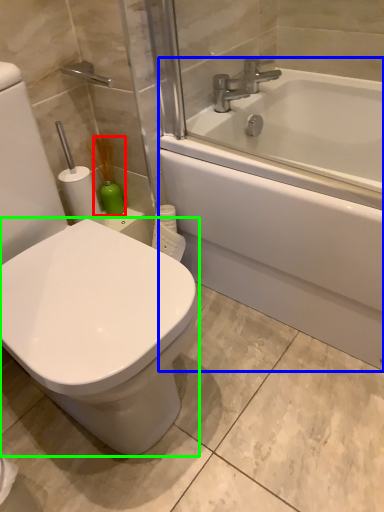
Question: Based on their relative distances, which object is farther from soap dispenser (highlighted by a red box)? Choose from bathtub (highlighted by a blue box) and bidet (highlighted by a green box).

Choices:
 (A) bathtub
 (B) bidet

Answer: (B)